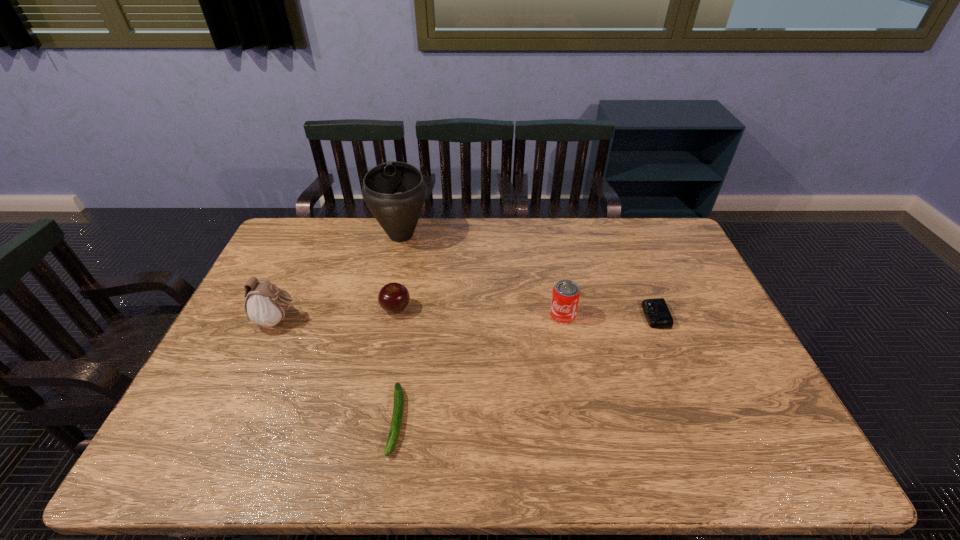
This screenshot has height=540, width=960. What are the coordinates of `vacant space at the far edge of the desktop` in the screenshot? It's located at (439, 220).

Image resolution: width=960 pixels, height=540 pixels. I want to click on blank space at the near edge, so click(x=686, y=446).

The image size is (960, 540). Identify the location of free space at the left edge of the desktop. (228, 336).

Image resolution: width=960 pixels, height=540 pixels. I want to click on vacant space at the right edge of the desktop, so click(x=711, y=342).

Identify the location of empty space that is in between the urn and the zucchini. (399, 328).

At what (x,y) coordinates should I click in order to perform the action: click on vacant space that is in between the rightmost object and the second object from right to left. Please return your answer as a coordinate pair (x, y). The width and height of the screenshot is (960, 540). Looking at the image, I should click on (609, 315).

Identify the location of empty space between the fifth object from left to right and the apple. (479, 312).

Where is `vacant region between the alarm clock and the nearest object`? vacant region between the alarm clock and the nearest object is located at coordinates (526, 368).

This screenshot has width=960, height=540. I want to click on free space between the rightmost object and the farthest object, so click(x=528, y=275).

In order to click on vacant area between the urn and the leftmost object in this screenshot , I will do `click(340, 278)`.